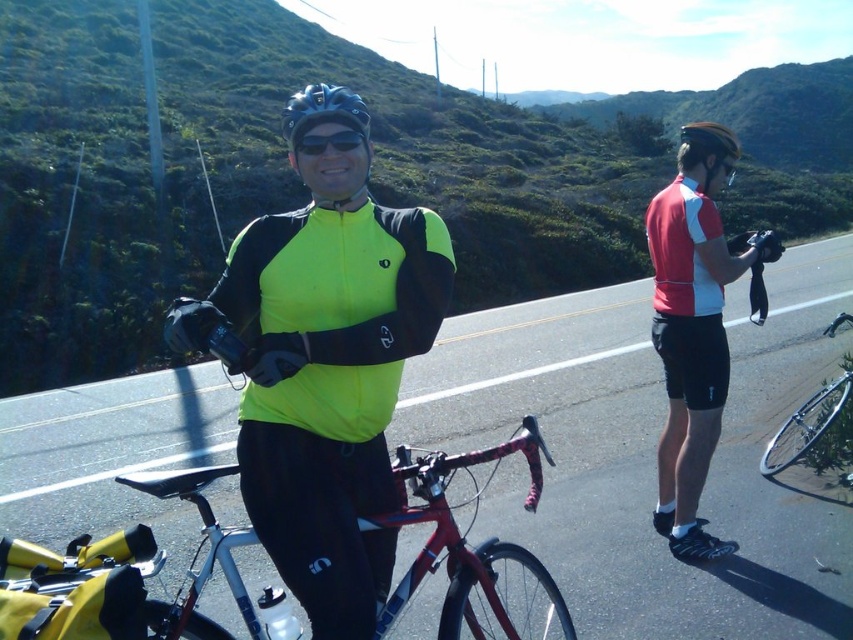
Question: Is shiny red bicycle at center below matte black helmet at upper right?

Choices:
 (A) yes
 (B) no

Answer: (A)

Question: Does neon yellow fabric at center appear over shiny silver bicycle at lower right?

Choices:
 (A) yes
 (B) no

Answer: (A)

Question: Which point is farther to the camera?

Choices:
 (A) matte black helmet at upper right
 (B) neon yellow fabric at center

Answer: (A)

Question: Does neon yellow fabric at center appear on the left side of black matte helmet at center?

Choices:
 (A) yes
 (B) no

Answer: (B)

Question: Which of these objects is positioned farthest from the neon yellow fabric at center?

Choices:
 (A) shiny silver bicycle at lower right
 (B) shiny red bicycle at center

Answer: (A)

Question: Which point is farther to the camera?

Choices:
 (A) (750, 294)
 (B) (724, 134)
 (C) (343, 138)

Answer: (A)